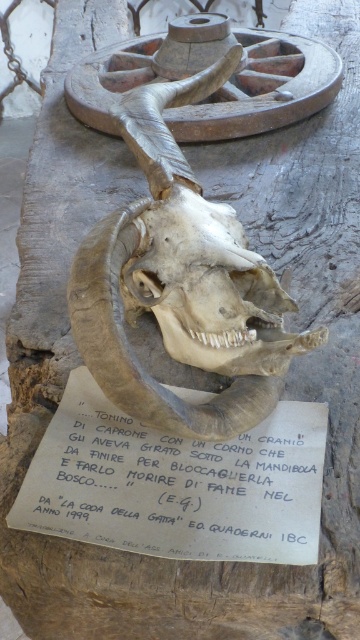
Question: Is brown leather skull at center closer to the viewer compared to brown textured skull at center?

Choices:
 (A) no
 (B) yes

Answer: (B)

Question: Does white paper at center appear on the left side of brown textured skull at center?

Choices:
 (A) yes
 (B) no

Answer: (A)

Question: Can you confirm if brown leather skull at center is wider than brown textured skull at center?

Choices:
 (A) yes
 (B) no

Answer: (A)

Question: Which of the following is the farthest from the observer?

Choices:
 (A) white paper at center
 (B) brown leather skull at center

Answer: (B)

Question: Which point is farther to the camera?

Choices:
 (A) coord(214,353)
 (B) coord(257,262)

Answer: (B)

Question: Which point is farther to the camera?

Choices:
 (A) (290, 300)
 (B) (201, 518)
 (C) (158, 272)

Answer: (A)